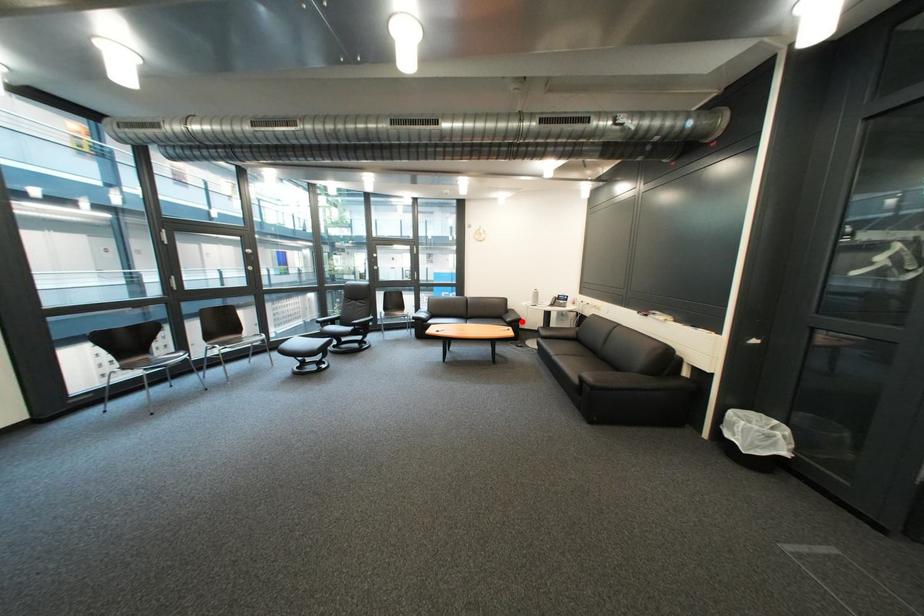
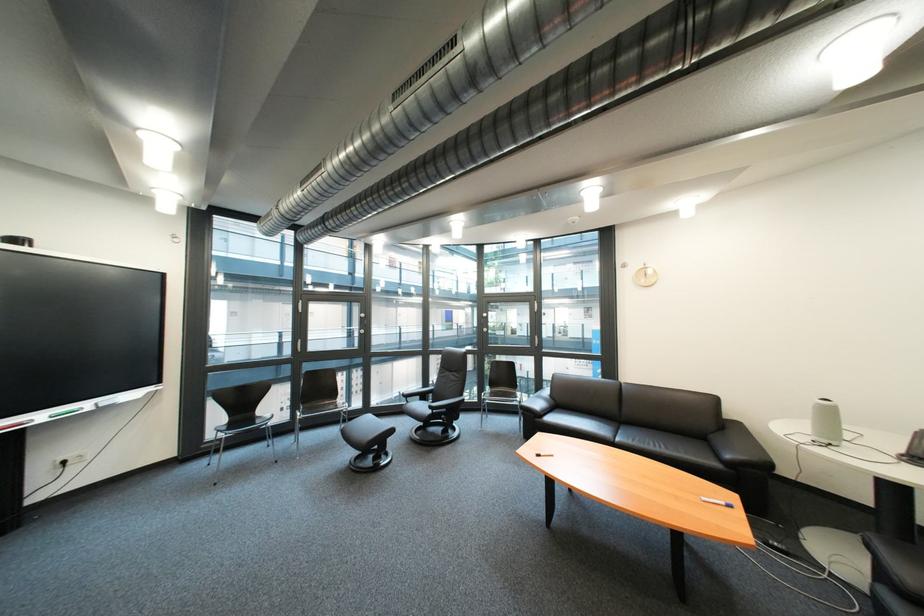
Where in the second image is the point corresponding to the highlighted location from the first image?

(742, 458)